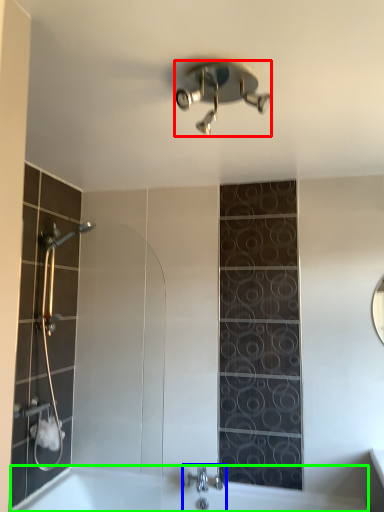
Question: Considering the real-world distances, which object is closest to shower (highlighted by a red box)? tap (highlighted by a blue box) or bath (highlighted by a green box).

Choices:
 (A) tap
 (B) bath

Answer: (A)